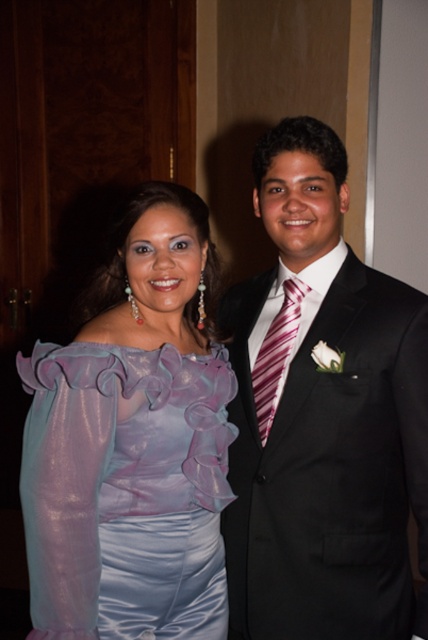
You are a photographer at a formal event and need to adjust the lighting to ensure both the shiny black suit at center and the translucent purple blouse at upper left are well lit. Which object should you focus on first to ensure proper exposure, considering their positions?

The shiny black suit at center is positioned on the right side of translucent purple blouse at upper left. Since the shiny black suit at center is darker, it may require more light to avoid underexposure, so focus on it first.

You are a photographer at a formal event. You need to ensure that the shiny black suit at center and the striped silk tie at center are both visible in your photo. Given that your camera can only focus on objects larger than 2 inches in the frame, will both items be visible?

The shiny black suit at center is bigger than the striped silk tie at center. Since the camera requires objects to be larger than 2 inches, and the shiny black suit is larger, it will be visible. However, the size of the striped silk tie is not specified, so we cannot confirm if it meets the 2 inch requirement. However, based on typical sizes, the striped silk tie at center might be smaller than 2 inches and thus may not be visible.